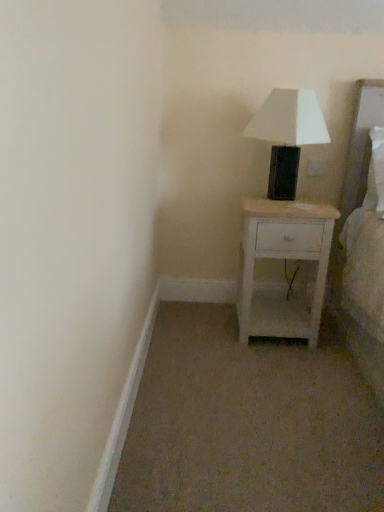
Question: From a real-world perspective, is white wood nightstand at center physically located above or below white matte table lamp at upper right?

Choices:
 (A) above
 (B) below

Answer: (B)

Question: Looking at the image, does white wood nightstand at center seem bigger or smaller compared to white matte table lamp at upper right?

Choices:
 (A) big
 (B) small

Answer: (A)

Question: In terms of width, does white wood nightstand at center look wider or thinner when compared to white matte table lamp at upper right?

Choices:
 (A) wide
 (B) thin

Answer: (A)

Question: From a real-world perspective, is white matte table lamp at upper right physically located above or below white wood nightstand at center?

Choices:
 (A) below
 (B) above

Answer: (B)

Question: Considering the positions of white matte table lamp at upper right and white wood nightstand at center in the image, is white matte table lamp at upper right taller or shorter than white wood nightstand at center?

Choices:
 (A) tall
 (B) short

Answer: (B)

Question: Considering their positions, is white matte table lamp at upper right located in front of or behind white wood nightstand at center?

Choices:
 (A) behind
 (B) front

Answer: (B)

Question: Which is correct: white matte table lamp at upper right is inside white wood nightstand at center, or outside of it?

Choices:
 (A) outside
 (B) inside

Answer: (A)